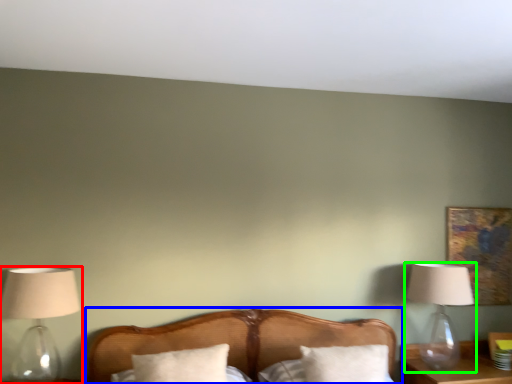
Question: Considering the real-world distances, which object is farthest from lamp (highlighted by a red box)? bed (highlighted by a blue box) or lamp (highlighted by a green box)?

Choices:
 (A) bed
 (B) lamp

Answer: (B)